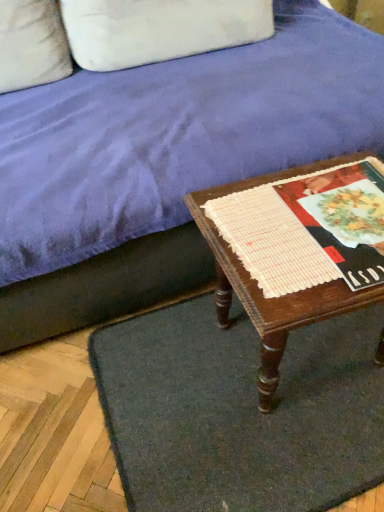
You are a GUI agent. You are given a task and a screenshot of the screen. Output one action in this format:
    pyautogui.click(x=<x>, y=<y>)
    Task: Click on the free space in front of wooden table at lower right
    The width and height of the screenshot is (384, 512).
    Given the screenshot: What is the action you would take?
    pyautogui.click(x=300, y=459)